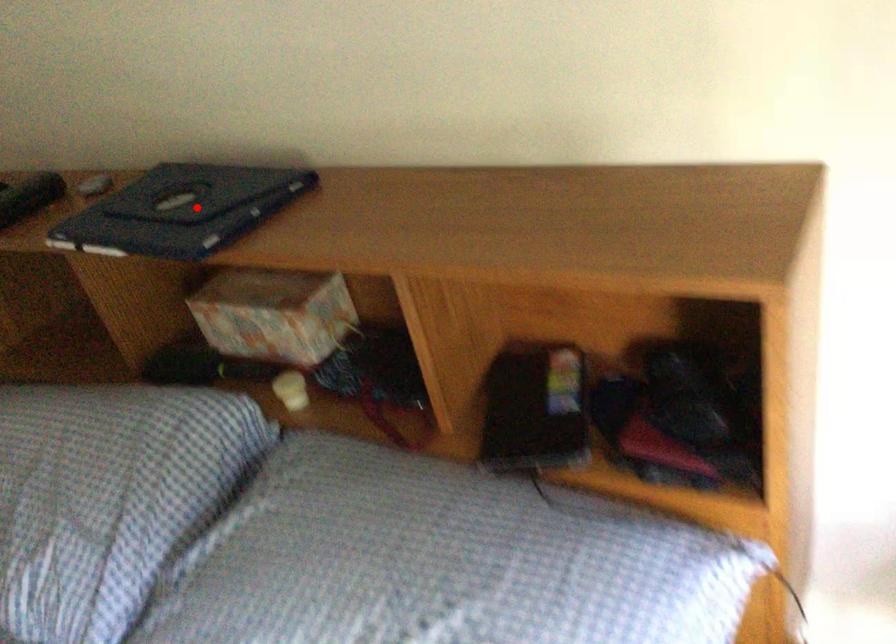
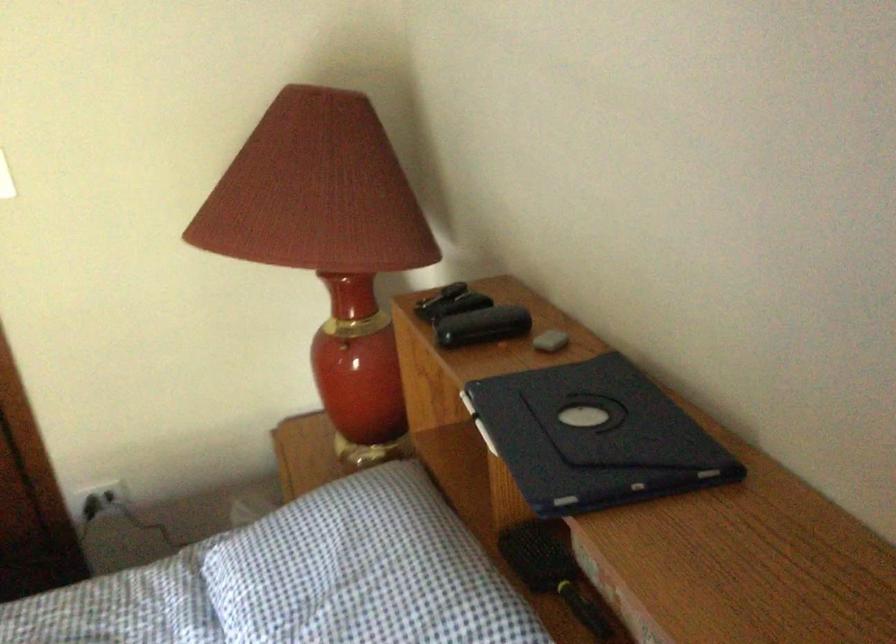
The point at the highlighted location is marked in the first image. Where is the corresponding point in the second image?

(593, 437)